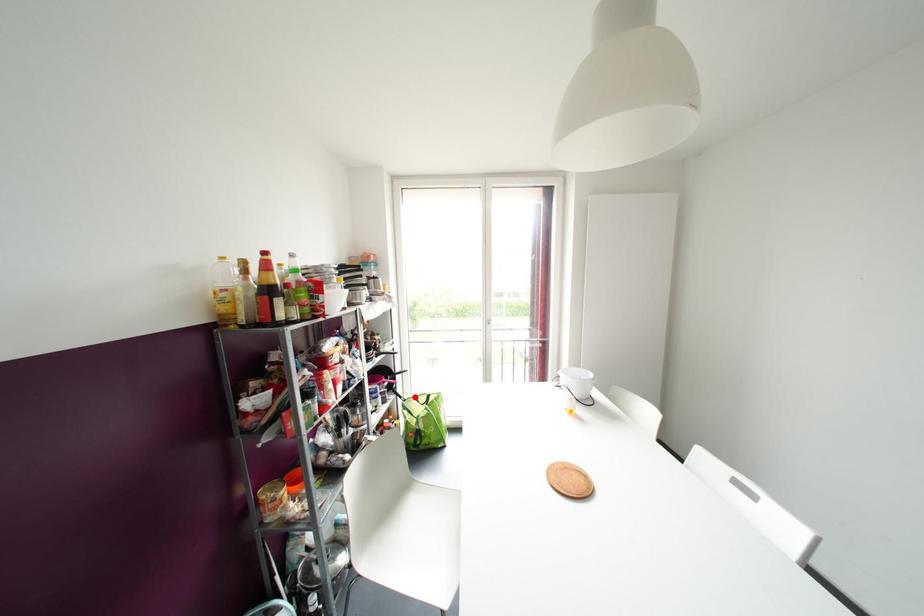
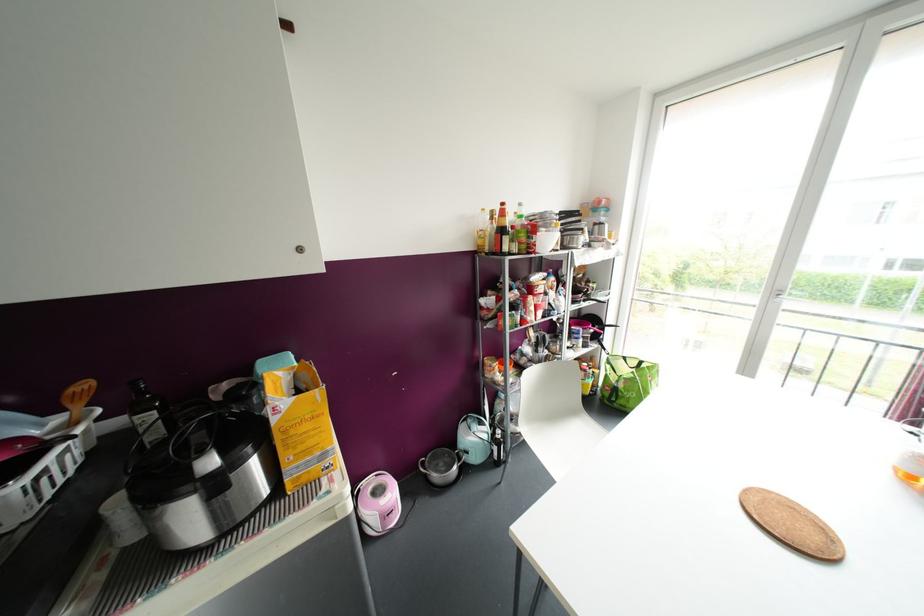
Question: I am providing you with two images of the same scene from different viewpoints. Image1 has a red point marked. In image2, the corresponding 3D location appears at what relative position? Reply with the corresponding letter.

Choices:
 (A) Closer
 (B) Farther

Answer: (A)